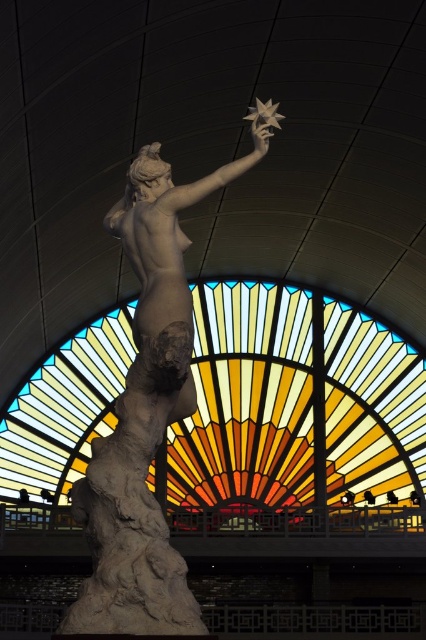
You are an art curator planning to install a spotlight on the stained glass at center and the matte stone statue at center. According to the scene description, which object should the spotlight be placed to the left of to illuminate both effectively?

The spotlight should be placed to the left of the stained glass at center because it is to the right of the matte stone statue at center, so positioning it to the left of the stained glass will allow both objects to be illuminated.

You are standing in the room with the classical sculpture and want to determine which of the two points, point (380, 481) or point (259, 99), is closer to you. Which one is closer?

Point (380, 481) is further to the viewer than point (259, 99), so the closer point to you is point (259, 99).